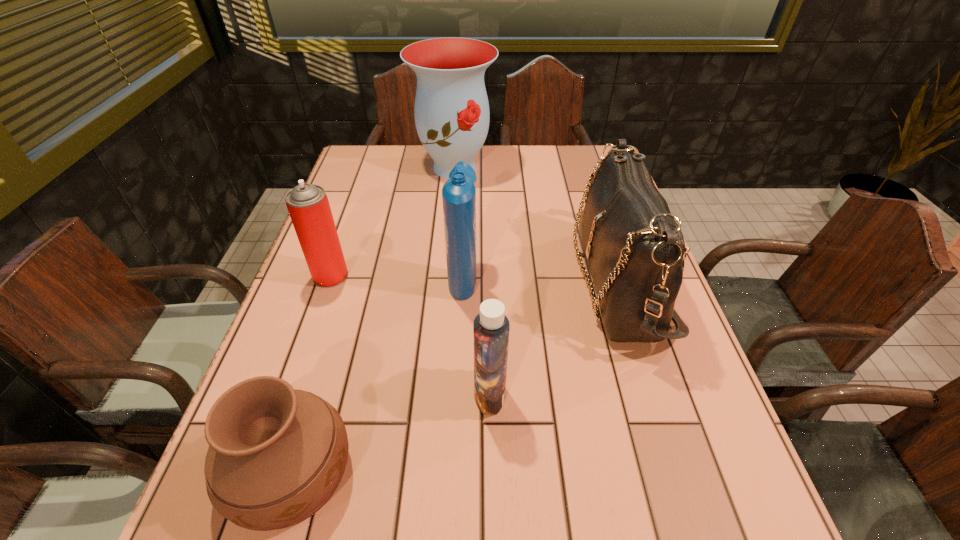
Locate an element on the screen. free location located on the right of the aerosol can is located at coordinates (479, 276).

Image resolution: width=960 pixels, height=540 pixels. I want to click on vacant space located 0.280m on the front label of the shorter shampoo, so click(x=328, y=394).

Where is `free space located 0.220m on the front label of the shorter shampoo`? The width and height of the screenshot is (960, 540). free space located 0.220m on the front label of the shorter shampoo is located at coordinates (359, 394).

Where is `vacant area situated 0.360m on the front label of the shorter shampoo`? Image resolution: width=960 pixels, height=540 pixels. vacant area situated 0.360m on the front label of the shorter shampoo is located at coordinates (286, 394).

Identify the location of object present at the far edge. This screenshot has width=960, height=540. (451, 110).

I want to click on object positioned at the left edge, so click(x=308, y=206).

The width and height of the screenshot is (960, 540). Identify the location of object that is at the right edge. (634, 247).

Find the location of a particular element. blank space at the far edge is located at coordinates (488, 170).

Locate an element on the screen. free region at the left edge of the desktop is located at coordinates (355, 211).

At what (x,y) coordinates should I click in order to perform the action: click on free space at the right edge of the desktop. Please return your answer as a coordinate pair (x, y). This screenshot has height=540, width=960. Looking at the image, I should click on (695, 404).